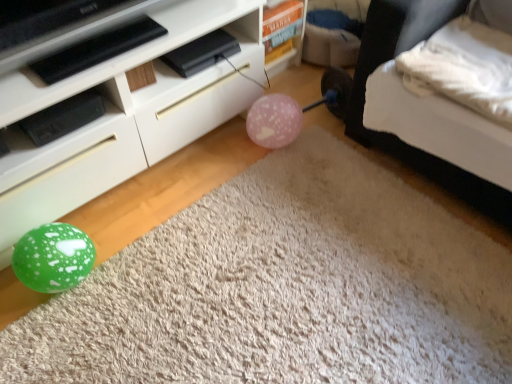
Identify the location of vacant space to the right of pink matte balloon at center. (315, 147).